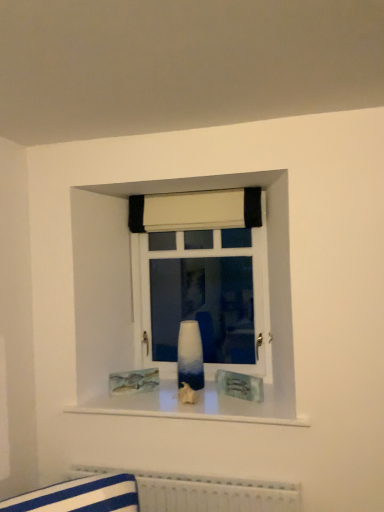
Question: In terms of width, does blue glossy vase at center look wider or thinner when compared to ombre glass vase at center?

Choices:
 (A) wide
 (B) thin

Answer: (A)

Question: From a real-world perspective, is blue glossy vase at center above or below ombre glass vase at center?

Choices:
 (A) above
 (B) below

Answer: (B)

Question: Which object is the closest to the white fabric curtain at upper center?

Choices:
 (A) blue glossy vase at center
 (B) ombre glass vase at center
 (C) white textured radiator at lower center

Answer: (B)

Question: Estimate the real-world distances between objects in this image. Which object is closer to the white fabric curtain at upper center?

Choices:
 (A) white textured radiator at lower center
 (B) blue glossy vase at center
 (C) ombre glass vase at center

Answer: (C)